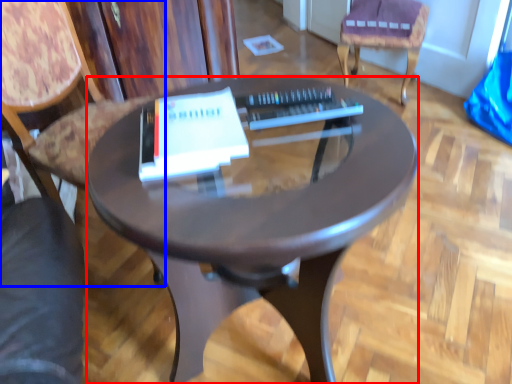
Question: Which object is closer to the camera taking this photo, desk (highlighted by a red box) or chair (highlighted by a blue box)?

Choices:
 (A) desk
 (B) chair

Answer: (A)